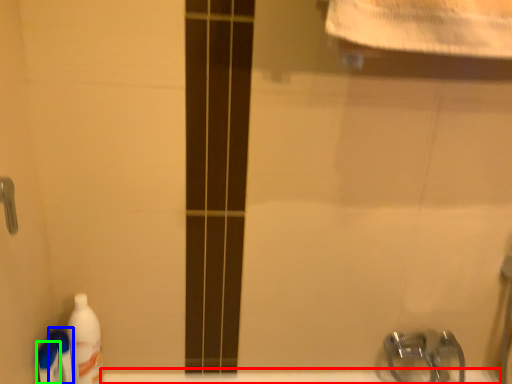
Question: Which object is the closest to the bath (highlighted by a red box)? Choose among these: cleaning product (highlighted by a blue box) or cleaning product (highlighted by a green box).

Choices:
 (A) cleaning product
 (B) cleaning product

Answer: (A)